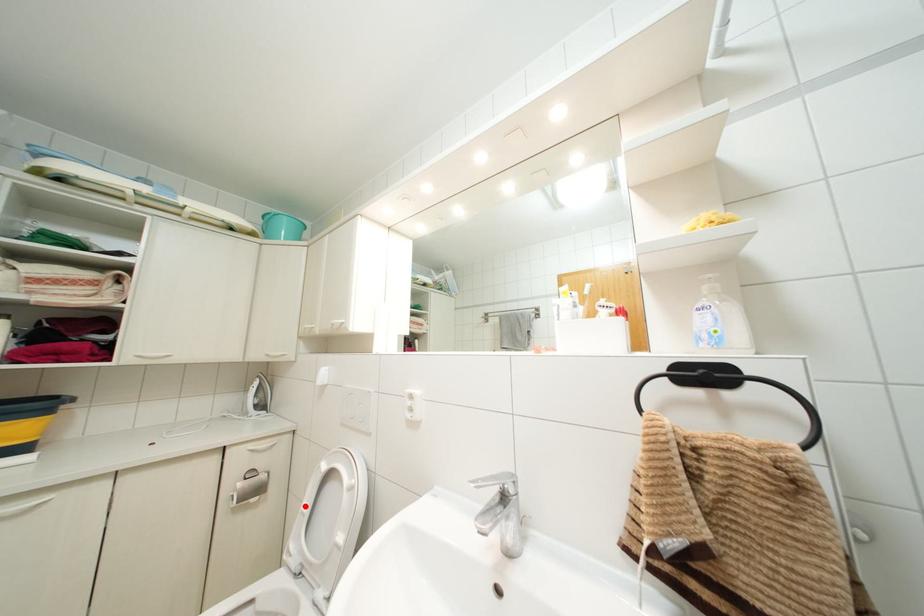
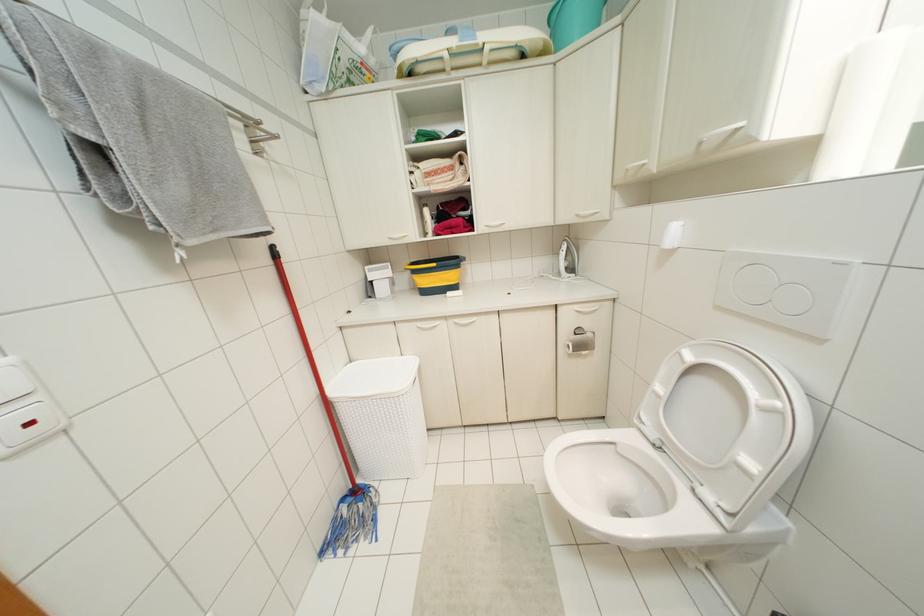
The point at the highlighted location is marked in the first image. Where is the corresponding point in the second image?

(659, 387)